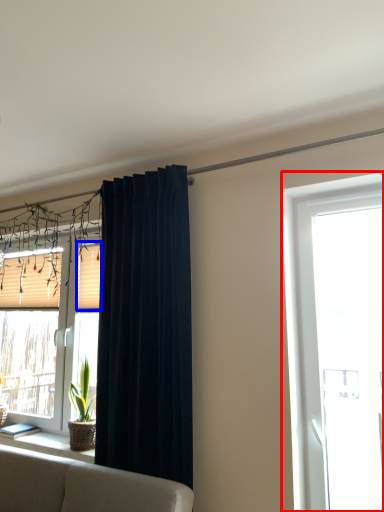
Question: Which of the following is the farthest to the observer, window (highlighted by a red box) or shutter (highlighted by a blue box)?

Choices:
 (A) window
 (B) shutter

Answer: (B)